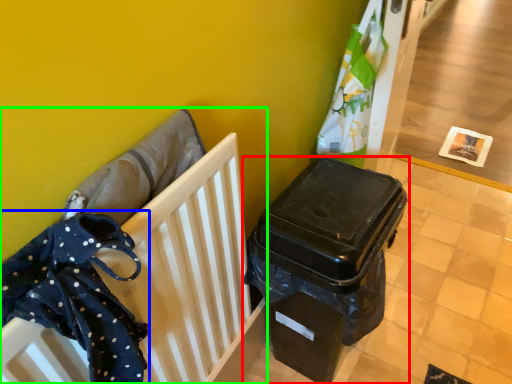
Question: Based on their relative distances, which object is nearer to waste container (highlighted by a red box)? Choose from clothe (highlighted by a blue box) and furniture (highlighted by a green box).

Choices:
 (A) clothe
 (B) furniture

Answer: (B)